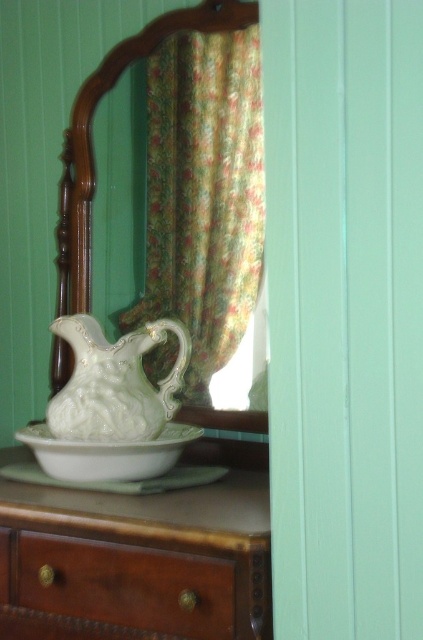
You are standing in front of the vintage dresser and want to place a small vase between the two points marked as point (233,579) and point (175,385) on the dresser top. Which point should the vase be closer to in order to be placed in front of the other point?

The vase should be placed closer to point (233,579) because it is in front of point (175,385).

You are arranging flowers in a vase and need to place them on the vintage dresser. The vase is matte white porcelain at center. Where should you place it relative to the white porcelain pitcher at center to match the existing arrangement shown in the image?

The matte white porcelain at center should be placed to the right of the white porcelain pitcher at center to match the existing arrangement shown in the image.

You are standing 2 feet away from the vintage dresser. A point at coordinates point (x=227, y=541) is located on the dresser. Can you reach this point without moving closer than your current position?

The distance of point (x=227, y=541) from viewer is 3.35 feet. Since you are currently 2 feet away, you cannot reach the point without moving closer as it is farther than your current distance.